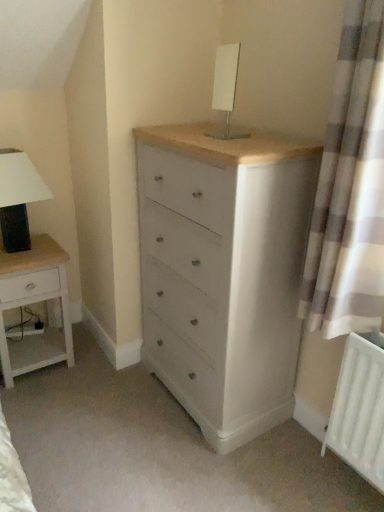
Locate an element on the screen. The width and height of the screenshot is (384, 512). vacant area situated below white checkered curtain at right (from a real-world perspective) is located at coordinates (314, 459).